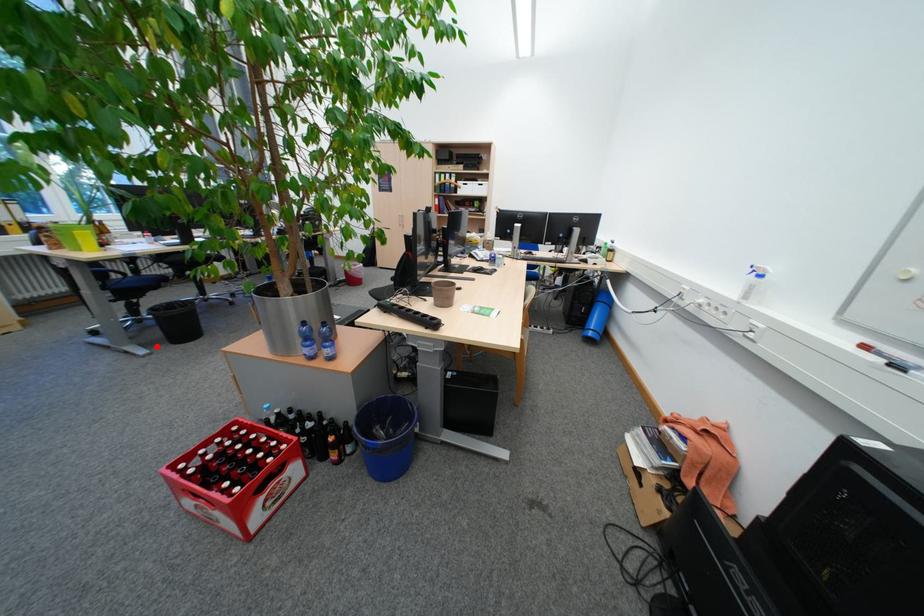
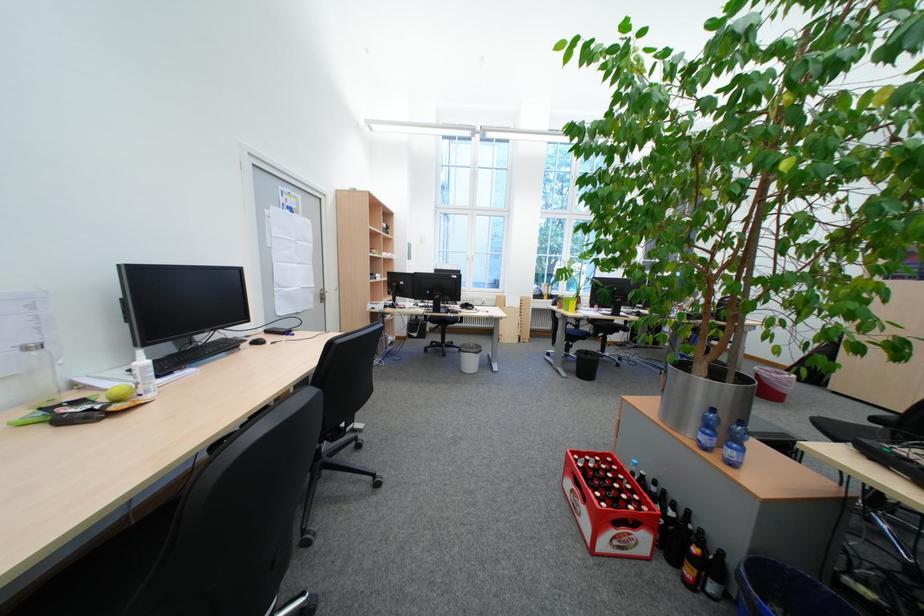
The point at the highlighted location is marked in the first image. Where is the corresponding point in the second image?

(578, 371)